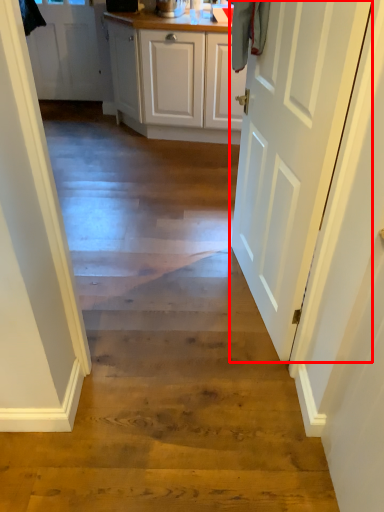
Question: From the image's perspective, what is the correct spatial relationship of door (annotated by the red box) in relation to door?

Choices:
 (A) above
 (B) below

Answer: (B)